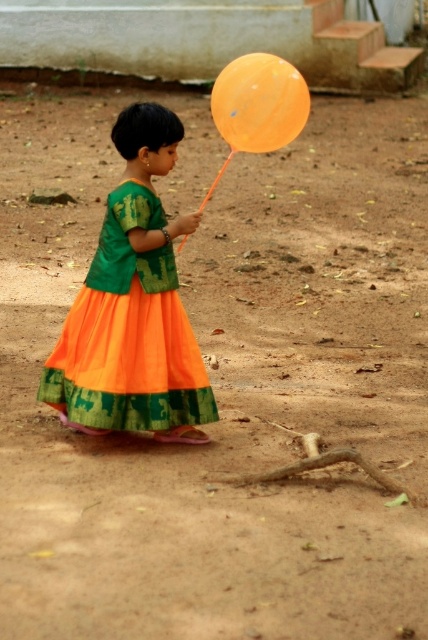
Question: Does orange chiffon dress at center appear on the right side of orange matte balloon at upper center?

Choices:
 (A) no
 (B) yes

Answer: (A)

Question: Is the position of orange chiffon dress at center less distant than that of orange matte balloon at upper center?

Choices:
 (A) no
 (B) yes

Answer: (B)

Question: Is orange chiffon dress at center smaller than orange matte balloon at upper center?

Choices:
 (A) yes
 (B) no

Answer: (B)

Question: Which object appears closest to the camera in this image?

Choices:
 (A) orange matte balloon at upper center
 (B) orange chiffon dress at center

Answer: (B)

Question: Which of the following is the farthest from the observer?

Choices:
 (A) orange matte balloon at upper center
 (B) orange chiffon dress at center

Answer: (A)